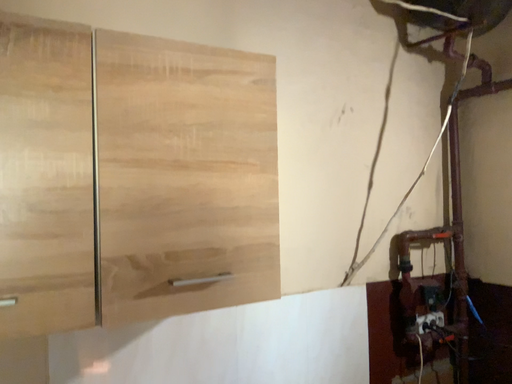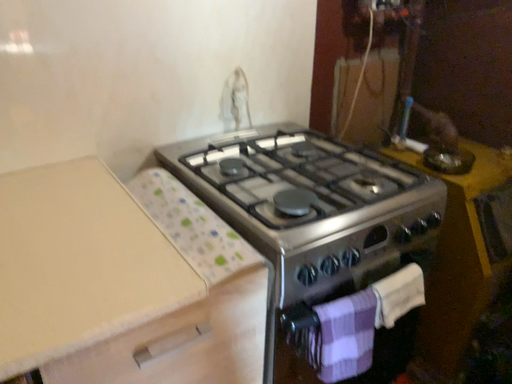
Question: How did the camera likely rotate when shooting the video?

Choices:
 (A) rotated downward
 (B) rotated upward

Answer: (A)